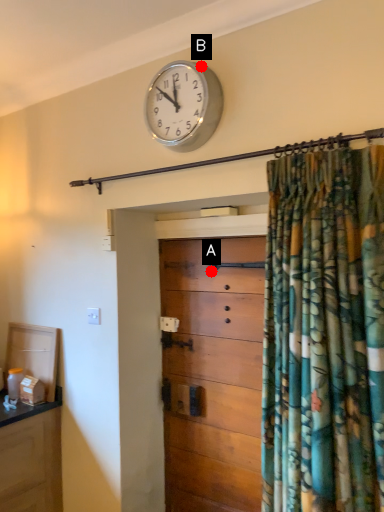
Question: Two points are circled on the image, labeled by A and B beside each circle. Which of the following is the farthest from the observer?

Choices:
 (A) A is further
 (B) B is further

Answer: (A)